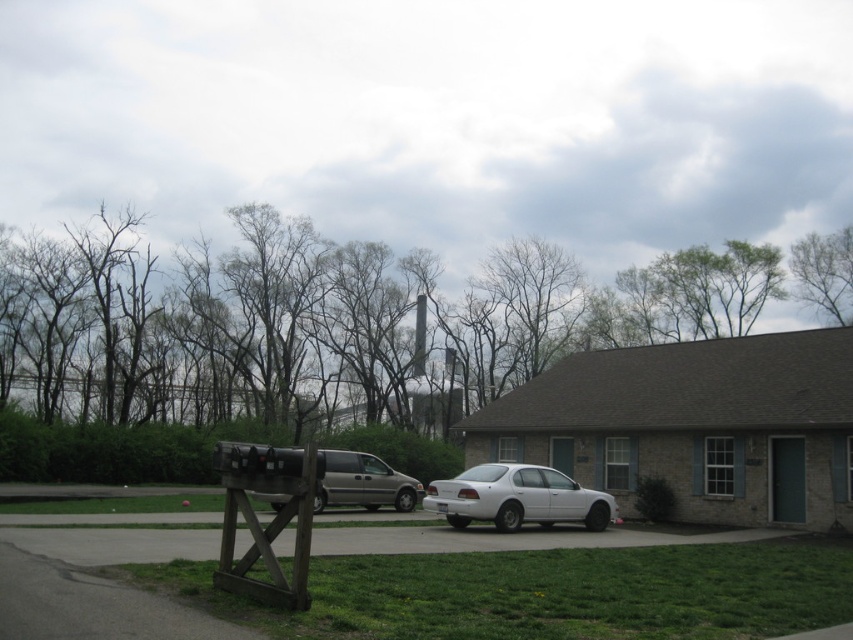
You are a delivery person trying to park your van next to the white matte sedan at center. The gray concrete driveway at lower center is the only available space. Can you fit your van there without crossing the driveway edges?

The gray concrete driveway at lower center might be wider than the white matte sedan at center, so there is a possibility that the driveway can accommodate the van, but there is uncertainty due to the comparative width.